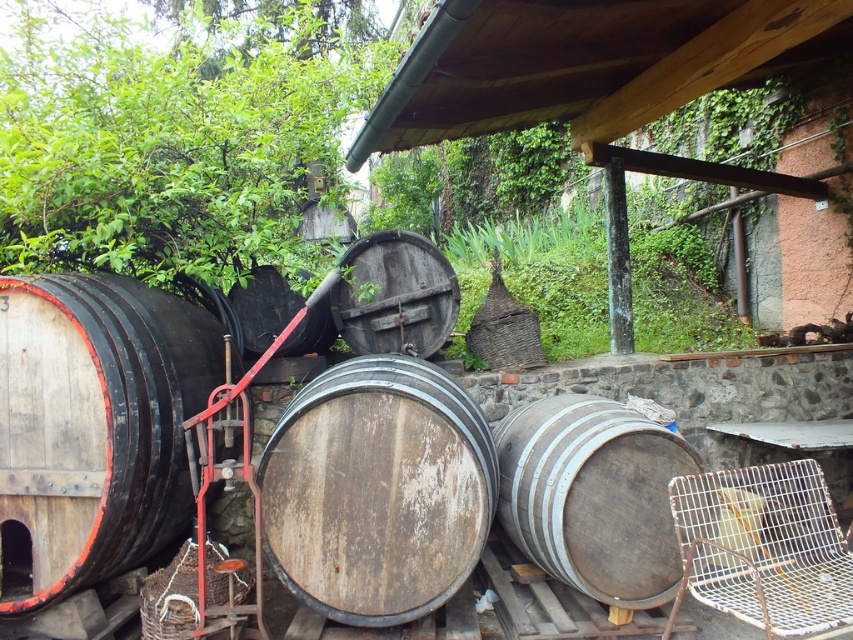
Is rusty wire chair at lower right to the right of dark brown wooden barrel at center from the viewer's perspective?

Indeed, rusty wire chair at lower right is positioned on the right side of dark brown wooden barrel at center.

Is rusty wire chair at lower right wider than dark brown wooden barrel at center?

Yes, rusty wire chair at lower right is wider than dark brown wooden barrel at center.

Image resolution: width=853 pixels, height=640 pixels. What do you see at coordinates (763, 547) in the screenshot?
I see `rusty wire chair at lower right` at bounding box center [763, 547].

Image resolution: width=853 pixels, height=640 pixels. Find the location of `rusty wire chair at lower right`. rusty wire chair at lower right is located at coordinates (763, 547).

Is point (438, 420) behind point (349, 280)?

That is False.

Which is in front, point (463, 416) or point (344, 276)?

Point (463, 416) is more forward.

Describe the element at coordinates (376, 490) in the screenshot. I see `weathered wood barrel at center` at that location.

Find the location of `weathered wood barrel at center`. weathered wood barrel at center is located at coordinates (376, 490).

Does weathered wood barrel at center appear under rusty wire chair at lower right?

Actually, weathered wood barrel at center is above rusty wire chair at lower right.

Is point (343, 552) closer to viewer compared to point (757, 595)?

No, it is behind (757, 595).

Identify the location of weathered wood barrel at center. Image resolution: width=853 pixels, height=640 pixels. (376, 490).